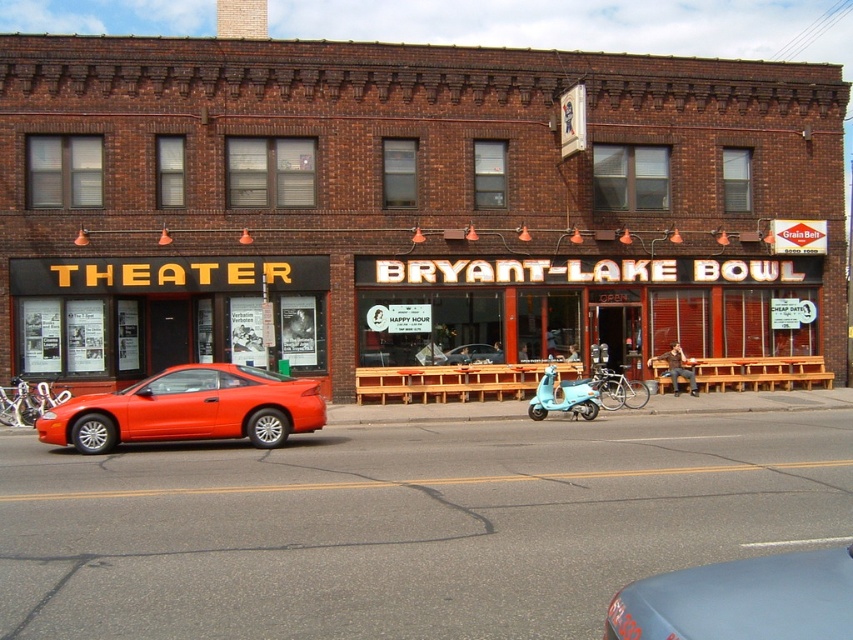
Does brick theater at center have a lesser width compared to light blue matte scooter at center?

Incorrect, brick theater at center's width is not less than light blue matte scooter at center's.

Which is in front, point (358, 76) or point (589, 385)?

Point (589, 385) is more forward.

Identify the location of brick theater at center. (405, 204).

Who is taller, brick theater at center or shiny orange car at left?

With more height is brick theater at center.

What do you see at coordinates (405, 204) in the screenshot? The height and width of the screenshot is (640, 853). I see `brick theater at center` at bounding box center [405, 204].

Is point (396, 88) in front of point (170, 433)?

No, it is behind (170, 433).

In order to click on brick theater at center in this screenshot , I will do `click(405, 204)`.

Does matte blue car at lower center have a larger size compared to light blue matte scooter at center?

Incorrect, matte blue car at lower center is not larger than light blue matte scooter at center.

Does matte blue car at lower center appear on the right side of light blue matte scooter at center?

Incorrect, matte blue car at lower center is not on the right side of light blue matte scooter at center.

Which is behind, point (733, 602) or point (561, 381)?

Positioned behind is point (561, 381).

I want to click on matte blue car at lower center, so click(740, 600).